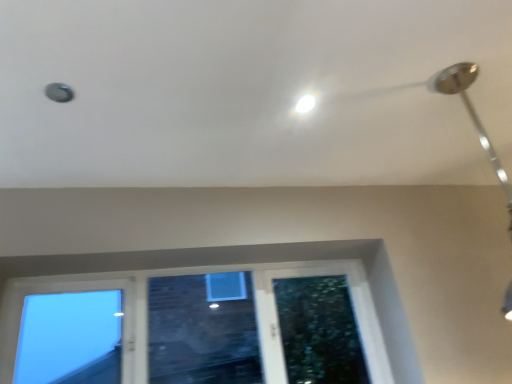
Question: From the image's perspective, is silver metallic lamp at upper right located above or below clear glass window at lower left?

Choices:
 (A) above
 (B) below

Answer: (A)

Question: In the image, is silver metallic lamp at upper right positioned in front of or behind clear glass window at lower left?

Choices:
 (A) front
 (B) behind

Answer: (A)

Question: Estimate the real-world distances between objects in this image. Which object is closer to the clear glass window at lower left?

Choices:
 (A) white glossy droplight at upper center
 (B) silver metallic lamp at upper right

Answer: (A)

Question: Based on their relative distances, which object is farther from the white glossy droplight at upper center?

Choices:
 (A) clear glass window at lower left
 (B) silver metallic lamp at upper right

Answer: (A)